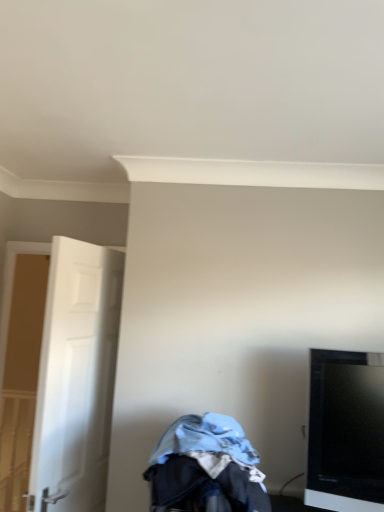
Question: In terms of size, does black glossy tv at right appear bigger or smaller than white matte door at left?

Choices:
 (A) big
 (B) small

Answer: (B)

Question: Does point (380, 418) appear closer or farther from the camera than point (97, 300)?

Choices:
 (A) closer
 (B) farther

Answer: (A)

Question: Which of these objects is positioned farthest from the white matte door at left?

Choices:
 (A) denim fabric baby carriage at lower center
 (B) black glossy tv at right

Answer: (B)

Question: Which is nearer to the denim fabric baby carriage at lower center?

Choices:
 (A) black glossy tv at right
 (B) white matte door at left

Answer: (A)